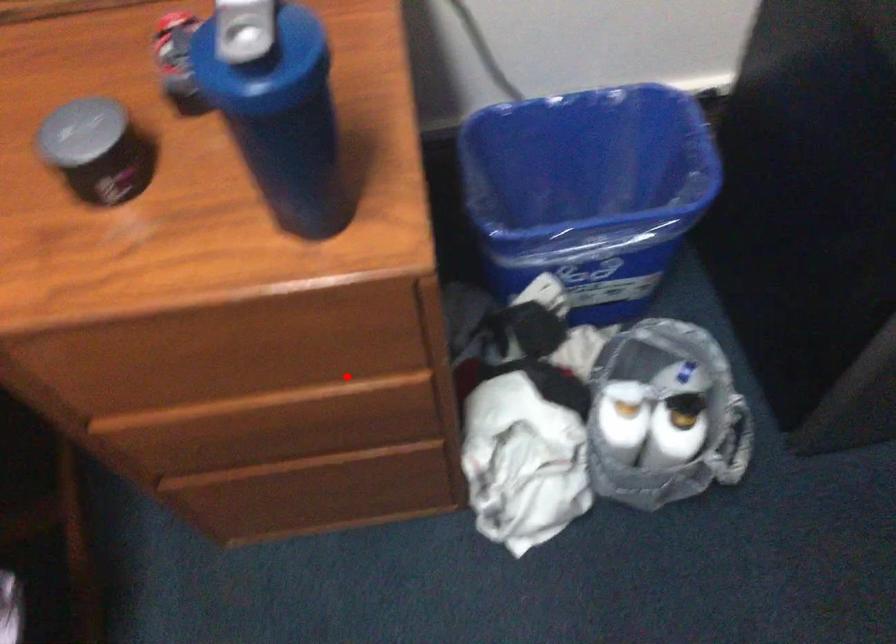
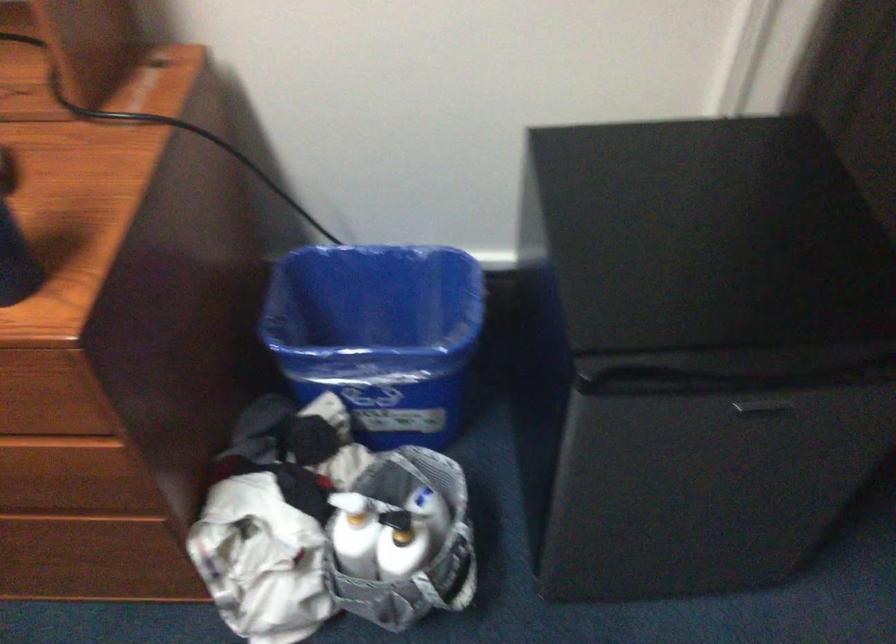
Question: I am providing you with two images of the same scene from different viewpoints. Given a red point in image1, look at the same physical point in image2. Is it:

Choices:
 (A) Closer to the viewpoint
 (B) Farther from the viewpoint

Answer: (B)